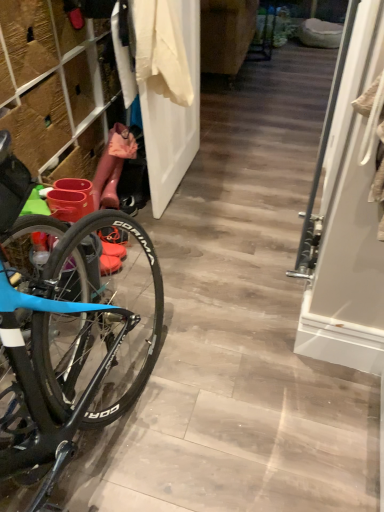
The width and height of the screenshot is (384, 512). What do you see at coordinates (161, 50) in the screenshot?
I see `white cotton shirt at upper center` at bounding box center [161, 50].

You are a GUI agent. You are given a task and a screenshot of the screen. Output one action in this format:
    pyautogui.click(x=<x>, y=<y>)
    Task: Click on the white glossy screen door at right
    The height and width of the screenshot is (512, 384).
    Given the screenshot: What is the action you would take?
    pyautogui.click(x=350, y=218)

Locate an element on the screen. The width and height of the screenshot is (384, 512). white matte door at center is located at coordinates (169, 94).

Looking at this image, is white glossy screen door at right oriented towards white cotton shirt at upper center?

No, white glossy screen door at right does not turn towards white cotton shirt at upper center.

Between white glossy screen door at right and white cotton shirt at upper center, which one has larger width?

With larger width is white cotton shirt at upper center.

Where is `clothing behind the white glossy screen door at right`? This screenshot has height=512, width=384. clothing behind the white glossy screen door at right is located at coordinates (161, 50).

From a real-world perspective, relative to rubber boots at left, is white glossy screen door at right vertically above or below?

In terms of real-world spatial position, white glossy screen door at right is above rubber boots at left.

Consider the image. From the image's perspective, which one is positioned higher, white glossy screen door at right or rubber boots at left?

rubber boots at left is shown above in the image.

Considering the sizes of white glossy screen door at right and rubber boots at left in the image, is white glossy screen door at right wider or thinner than rubber boots at left?

Considering their sizes, white glossy screen door at right looks slimmer than rubber boots at left.

Which is in front, white cotton shirt at upper center or white matte door at center?

white cotton shirt at upper center is in front.

Would you say white cotton shirt at upper center is a long distance from white matte door at center?

No.

From a real-world perspective, which is physically above, white cotton shirt at upper center or white matte door at center?

white cotton shirt at upper center.

In terms of height, does white cotton shirt at upper center look taller or shorter compared to white matte door at center?

In the image, white cotton shirt at upper center appears to be shorter than white matte door at center.

In the scene shown: Can you confirm if rubber boots at left is thinner than white cotton shirt at upper center?

Incorrect, the width of rubber boots at left is not less than that of white cotton shirt at upper center.

Is the surface of rubber boots at left in direct contact with white cotton shirt at upper center?

rubber boots at left and white cotton shirt at upper center are not in contact.

Based on the photo, is rubber boots at left situated inside white cotton shirt at upper center or outside?

rubber boots at left is not inside white cotton shirt at upper center, it's outside.

Considering the sizes of objects rubber boots at left and white cotton shirt at upper center in the image provided, who is shorter, rubber boots at left or white cotton shirt at upper center?

white cotton shirt at upper center.

Who is bigger, white matte door at center or white cotton shirt at upper center?

With larger size is white matte door at center.

Is white matte door at center looking in the opposite direction of white cotton shirt at upper center?

Absolutely, white matte door at center is directed away from white cotton shirt at upper center.

Is white matte door at center closer to the viewer compared to white cotton shirt at upper center?

No, it is behind white cotton shirt at upper center.

Can you confirm if white matte door at center is shorter than white cotton shirt at upper center?

Incorrect, the height of white matte door at center does not fall short of that of white cotton shirt at upper center.

Would you say white glossy screen door at right is a long distance from white matte door at center?

white glossy screen door at right is near white matte door at center, not far away.

Find the location of `door below the white glossy screen door at right (from a real-world perspective)`. door below the white glossy screen door at right (from a real-world perspective) is located at coordinates (169, 94).

Is white matte door at center at the back of white glossy screen door at right?

white glossy screen door at right does not have its back to white matte door at center.

Measure the distance from white glossy screen door at right to white matte door at center.

white glossy screen door at right and white matte door at center are 33.47 inches apart.

Can you confirm if white cotton shirt at upper center is thinner than white glossy screen door at right?

No, white cotton shirt at upper center is not thinner than white glossy screen door at right.

From a real-world perspective, is white cotton shirt at upper center physically located above or below white glossy screen door at right?

white cotton shirt at upper center is situated higher than white glossy screen door at right in the real world.

Locate an element on the screen. This screenshot has width=384, height=512. screen door below the white cotton shirt at upper center (from the image's perspective) is located at coordinates (350, 218).

Measure the distance between white cotton shirt at upper center and white glossy screen door at right.

A distance of 30.80 inches exists between white cotton shirt at upper center and white glossy screen door at right.

This screenshot has width=384, height=512. I want to click on clothing behind the white glossy screen door at right, so click(x=161, y=50).

Locate an element on the screen. The image size is (384, 512). screen door below the rubber boots at left (from the image's perspective) is located at coordinates (350, 218).

Based on their spatial positions, is white cotton shirt at upper center or white matte door at center further from rubber boots at left?

white cotton shirt at upper center lies further to rubber boots at left than the other object.

Estimate the real-world distances between objects in this image. Which object is closer to rubber boots at left, white glossy screen door at right or white cotton shirt at upper center?

white cotton shirt at upper center is positioned closer to the anchor rubber boots at left.

From the image, which object appears to be farther from white glossy screen door at right, white cotton shirt at upper center or rubber boots at left?

rubber boots at left is positioned further to the anchor white glossy screen door at right.

From the image, which object appears to be nearer to white glossy screen door at right, rubber boots at left or white cotton shirt at upper center?

white cotton shirt at upper center is positioned closer to the anchor white glossy screen door at right.

From the image, which object appears to be nearer to white cotton shirt at upper center, rubber boots at left or white glossy screen door at right?

Among the two, rubber boots at left is located nearer to white cotton shirt at upper center.

Based on their spatial positions, is white matte door at center or white cotton shirt at upper center further from white glossy screen door at right?

white matte door at center.

Looking at the image, which one is located closer to white matte door at center, rubber boots at left or white glossy screen door at right?

rubber boots at left is closer to white matte door at center.

Looking at the image, which one is located further to white glossy screen door at right, white cotton shirt at upper center or white matte door at center?

Among the two, white matte door at center is located further to white glossy screen door at right.

The height and width of the screenshot is (512, 384). What are the coordinates of `clothing between white matte door at center and white glossy screen door at right in the horizontal direction` in the screenshot? It's located at (161, 50).

Locate an element on the screen. The image size is (384, 512). door between rubber boots at left and white cotton shirt at upper center in the horizontal direction is located at coordinates (169, 94).

In order to click on clothing situated between rubber boots at left and white glossy screen door at right from left to right in this screenshot , I will do [x=161, y=50].

You are a GUI agent. You are given a task and a screenshot of the screen. Output one action in this format:
    pyautogui.click(x=<x>, y=<y>)
    Task: Click on the door between rubber boots at left and white glossy screen door at right from left to right
    
    Given the screenshot: What is the action you would take?
    pyautogui.click(x=169, y=94)